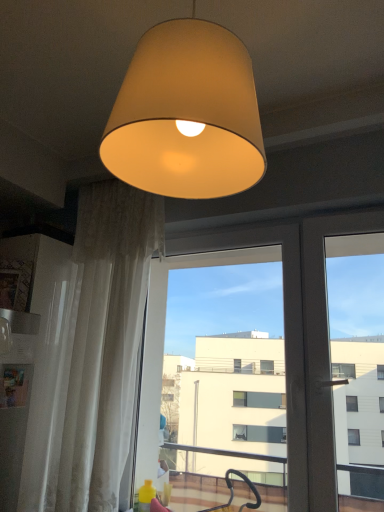
Question: Is matte beige lampshade at upper center at the left side of white sheer curtain at left?

Choices:
 (A) no
 (B) yes

Answer: (A)

Question: Is white sheer curtain at left a part of matte beige lampshade at upper center?

Choices:
 (A) no
 (B) yes

Answer: (A)

Question: Is matte beige lampshade at upper center oriented towards white sheer curtain at left?

Choices:
 (A) no
 (B) yes

Answer: (A)

Question: Is matte beige lampshade at upper center bigger than white sheer curtain at left?

Choices:
 (A) no
 (B) yes

Answer: (A)

Question: Can you confirm if matte beige lampshade at upper center is wider than white sheer curtain at left?

Choices:
 (A) no
 (B) yes

Answer: (B)

Question: From the image's perspective, is transparent glass screen door at center positioned above or below white sheer curtain at left?

Choices:
 (A) below
 (B) above

Answer: (A)

Question: From their relative heights in the image, would you say transparent glass screen door at center is taller or shorter than white sheer curtain at left?

Choices:
 (A) short
 (B) tall

Answer: (A)

Question: Considering their positions, is transparent glass screen door at center located in front of or behind white sheer curtain at left?

Choices:
 (A) front
 (B) behind

Answer: (A)

Question: From a real-world perspective, is transparent glass screen door at center positioned above or below white sheer curtain at left?

Choices:
 (A) below
 (B) above

Answer: (A)

Question: In terms of size, does transparent glass screen door at center appear bigger or smaller than matte beige lampshade at upper center?

Choices:
 (A) small
 (B) big

Answer: (B)

Question: Is transparent glass screen door at center wider or thinner than matte beige lampshade at upper center?

Choices:
 (A) thin
 (B) wide

Answer: (A)

Question: Considering the relative positions of transparent glass screen door at center and matte beige lampshade at upper center in the image provided, is transparent glass screen door at center to the left or to the right of matte beige lampshade at upper center?

Choices:
 (A) right
 (B) left

Answer: (A)

Question: From the image's perspective, is transparent glass screen door at center positioned above or below matte beige lampshade at upper center?

Choices:
 (A) above
 (B) below

Answer: (B)

Question: In terms of width, does matte beige lampshade at upper center look wider or thinner when compared to white sheer curtain at left?

Choices:
 (A) wide
 (B) thin

Answer: (A)

Question: In the image, is matte beige lampshade at upper center positioned in front of or behind white sheer curtain at left?

Choices:
 (A) front
 (B) behind

Answer: (A)